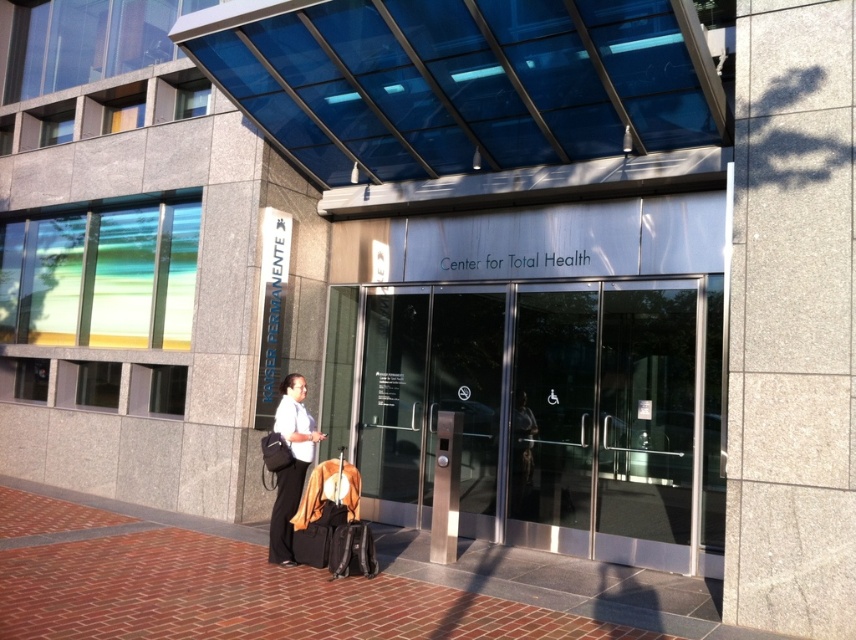
The image size is (856, 640). Find the location of `brown fabric suitcase at center`. brown fabric suitcase at center is located at coordinates (324, 509).

This screenshot has width=856, height=640. I want to click on brown fabric suitcase at center, so pos(324,509).

Who is higher up, brick pavement at lower left or brown fabric suitcase at center?

brown fabric suitcase at center is above.

Between brick pavement at lower left and brown fabric suitcase at center, which one appears on the left side from the viewer's perspective?

From the viewer's perspective, brown fabric suitcase at center appears more on the left side.

Locate an element on the screen. The image size is (856, 640). brick pavement at lower left is located at coordinates (568, 584).

At what (x,y) coordinates should I click in order to perform the action: click on brick pavement at lower left. Please return your answer as a coordinate pair (x, y). The height and width of the screenshot is (640, 856). Looking at the image, I should click on (568, 584).

Which is more to the right, matte black backpack at lower left or brown fabric suitcase at center?

Positioned to the right is brown fabric suitcase at center.

Is point (302, 444) positioned behind point (302, 536)?

Yes, point (302, 444) is farther from viewer.

Which is behind, point (290, 493) or point (331, 499)?

Point (290, 493)

You are a GUI agent. You are given a task and a screenshot of the screen. Output one action in this format:
    pyautogui.click(x=<x>, y=<y>)
    Task: Click on the matte black backpack at lower left
    The height and width of the screenshot is (640, 856).
    Given the screenshot: What is the action you would take?
    pyautogui.click(x=290, y=465)